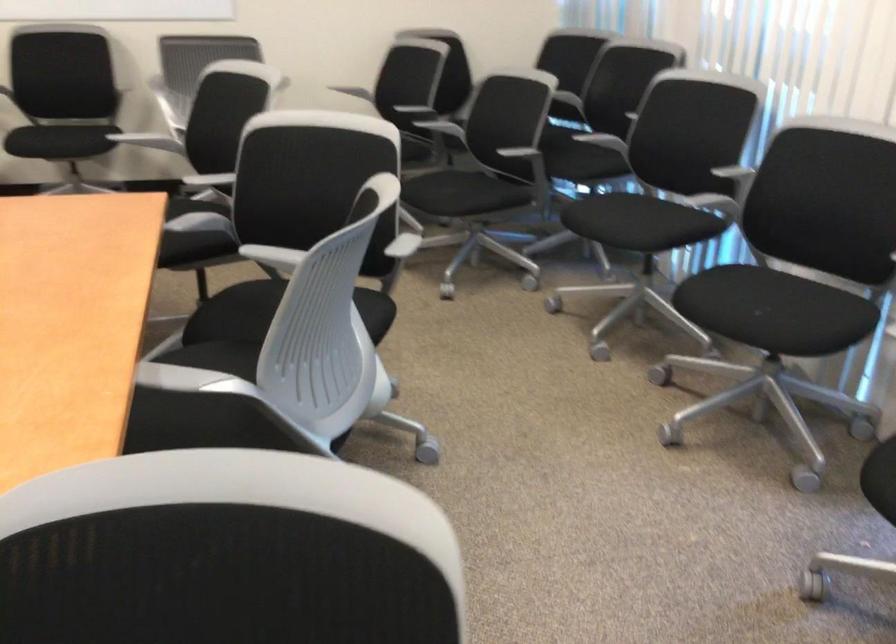
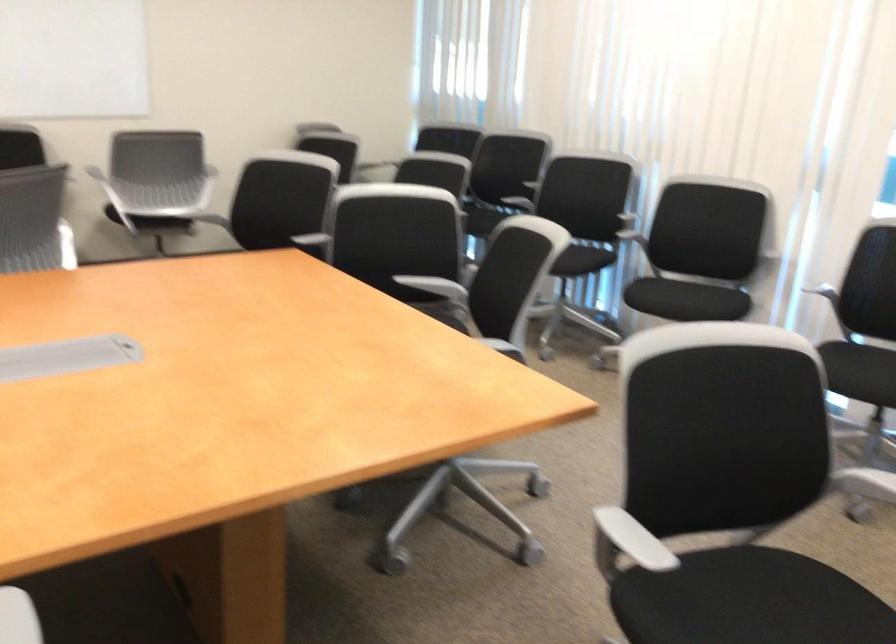
In a continuous first-person perspective shot, in which direction is the camera moving?

The cameraman moved toward left, backward.